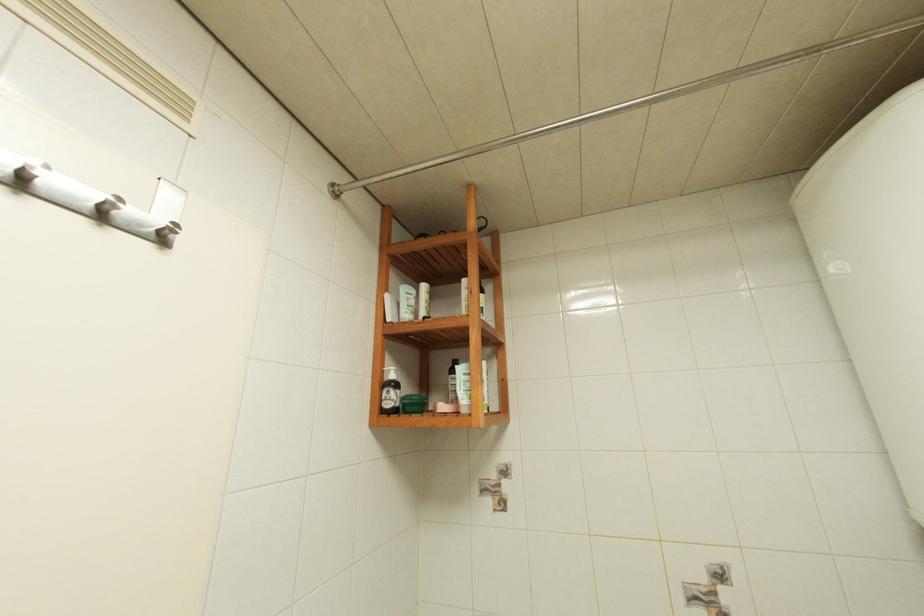
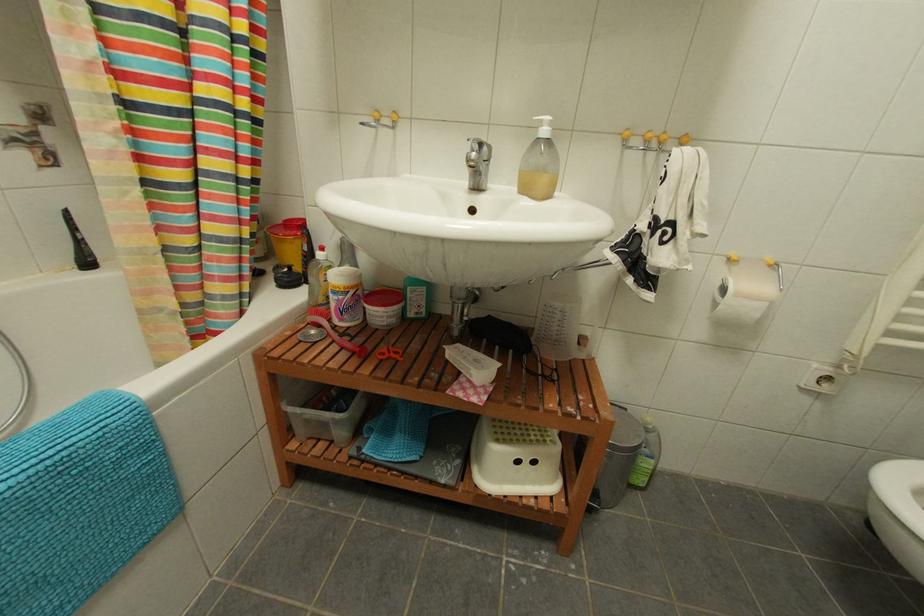
Based on the continuous images, in which direction is the camera rotating?

The camera rotated toward right-down.